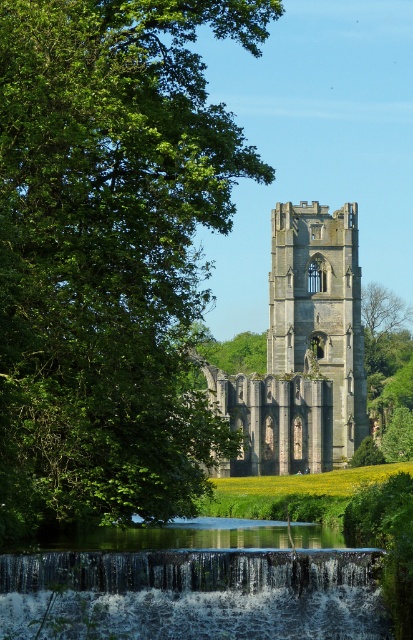
You are standing at the point marked as point [197,586] in the image. What do you see immediately around you?

You are standing at the translucent water cascade at lower center located at point [197,586].

You are a photographer planning to capture the green leafy tree at upper left and the translucent water cascade at lower center in a single shot. Based on their positions, will the tree appear to be in front of or behind the water cascade in the photo?

The green leafy tree at upper left is positioned over the translucent water cascade at lower center, so in the photo, the tree will appear to be in front of the water cascade.

You are standing at the base of the historic stone structure and want to reach the point marked as point (251,628). From your current position, which direction should you move relative to the point (324,401) to reach your destination?

To reach point (251,628), you should move towards the direction that is in front of point (324,401) since point (251,628) is located in front of point (324,401) according to their spatial relationship.